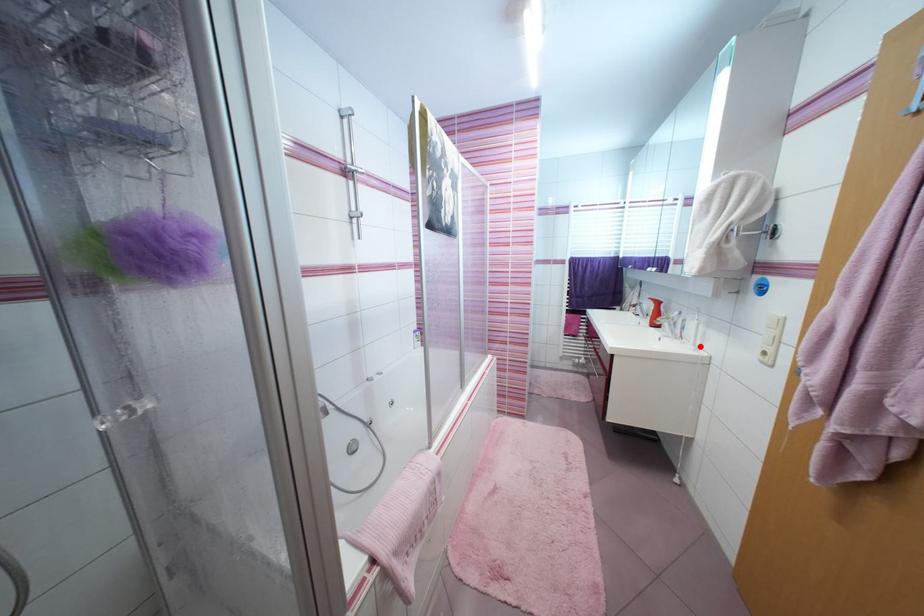
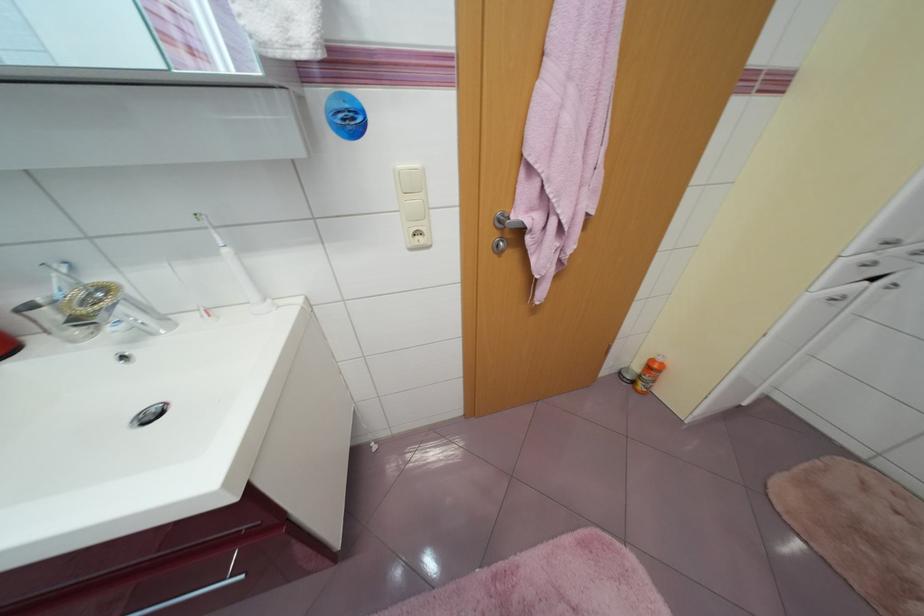
In the second image, find the point that corresponds to the highlighted location in the first image.

(270, 302)